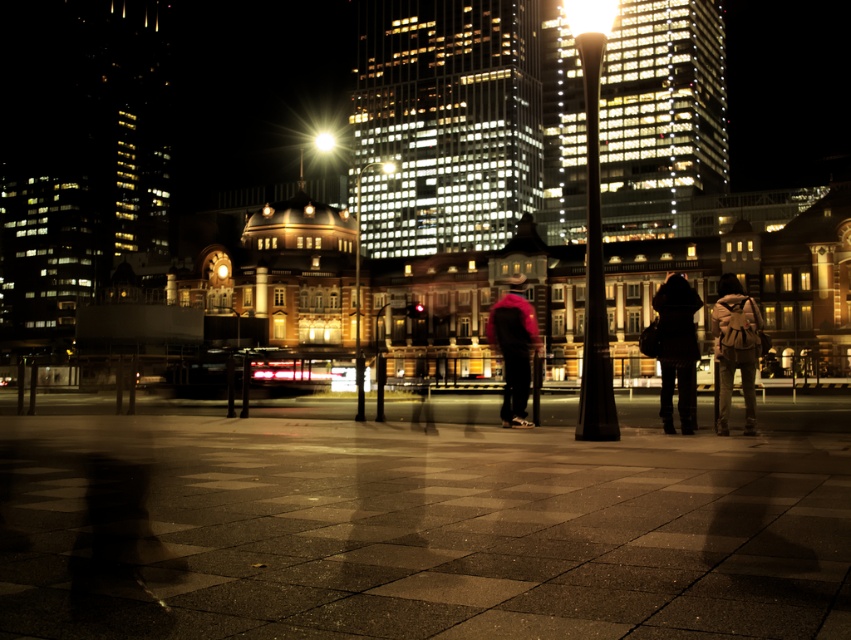
Question: Which object is closer to the camera taking this photo?

Choices:
 (A) dark matte coat at center
 (B) smooth concrete pavement at center
 (C) brown leather backpack at center

Answer: (B)

Question: Is dark matte coat at center to the left of velvet pink sweater at center from the viewer's perspective?

Choices:
 (A) yes
 (B) no

Answer: (B)

Question: Is brown leather backpack at center closer to the viewer compared to velvet pink sweater at center?

Choices:
 (A) no
 (B) yes

Answer: (B)

Question: Considering the relative positions of smooth concrete pavement at center and velvet pink sweater at center in the image provided, where is smooth concrete pavement at center located with respect to velvet pink sweater at center?

Choices:
 (A) below
 (B) above

Answer: (A)

Question: Which object is closer to the camera taking this photo?

Choices:
 (A) smooth concrete pavement at center
 (B) brown leather backpack at center
 (C) velvet pink sweater at center
 (D) dark matte coat at center

Answer: (A)

Question: Based on their relative distances, which object is farther from the velvet pink sweater at center?

Choices:
 (A) smooth concrete pavement at center
 (B) dark matte coat at center

Answer: (A)